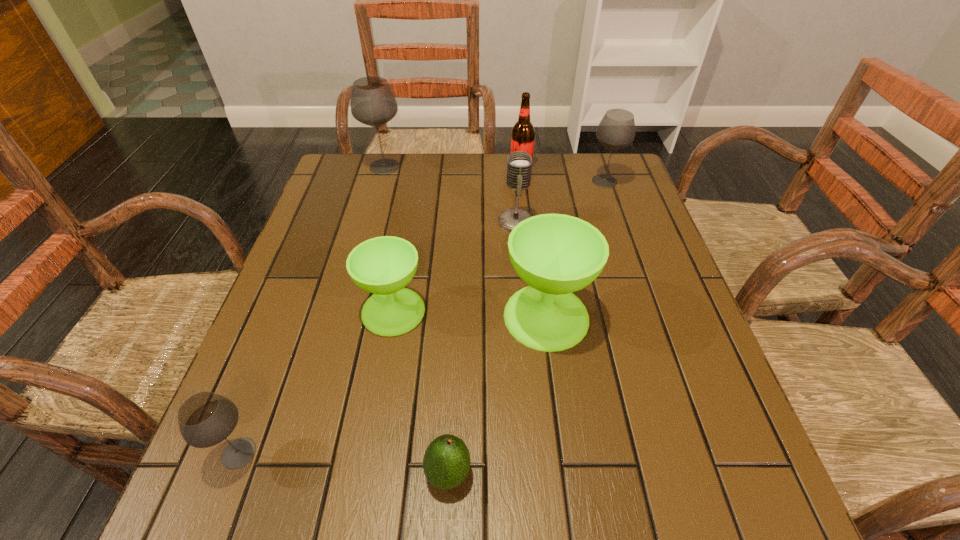
Find the location of a particular element. free space located 0.310m on the back of the nearest wineglass is located at coordinates (299, 296).

In order to click on free space located 0.200m on the back of the green avocado in this screenshot , I will do `click(454, 351)`.

Identify the location of root beer positioned at the far edge. (523, 133).

Find the location of `wineglass that is at the near edge`. wineglass that is at the near edge is located at coordinates (205, 419).

At what (x,y) coordinates should I click in order to perform the action: click on avocado that is positioned at the near edge. Please return your answer as a coordinate pair (x, y). This screenshot has width=960, height=540. Looking at the image, I should click on (446, 463).

This screenshot has height=540, width=960. I want to click on object located in the right edge section of the desktop, so click(616, 130).

Find the location of a particular element. This screenshot has height=540, width=960. object situated at the far left corner is located at coordinates (372, 103).

Where is `object located at the near left corner`? object located at the near left corner is located at coordinates (205, 419).

Image resolution: width=960 pixels, height=540 pixels. I want to click on object that is at the far right corner, so click(616, 130).

In the image, there is a desktop. Where is `blank space at the far edge`? blank space at the far edge is located at coordinates (443, 174).